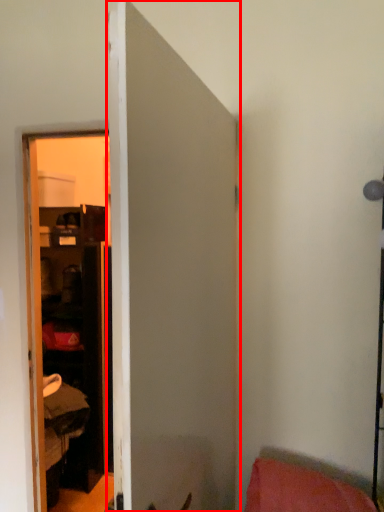
Question: Observing the image, what is the correct spatial positioning of door (annotated by the red box) in reference to pillow?

Choices:
 (A) left
 (B) right

Answer: (A)